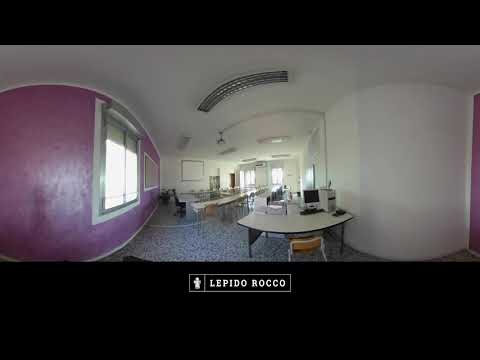
The width and height of the screenshot is (480, 360). In order to click on desktop computer tower in this screenshot , I will do pyautogui.click(x=330, y=198).